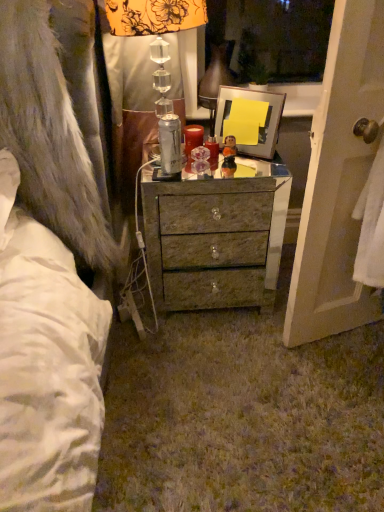
You are a GUI agent. You are given a task and a screenshot of the screen. Output one action in this format:
    pyautogui.click(x=<x>, y=<y>)
    Task: Click on the vacant area situated below white towel at right (from a real-world perspective)
    
    Given the screenshot: What is the action you would take?
    pyautogui.click(x=362, y=354)